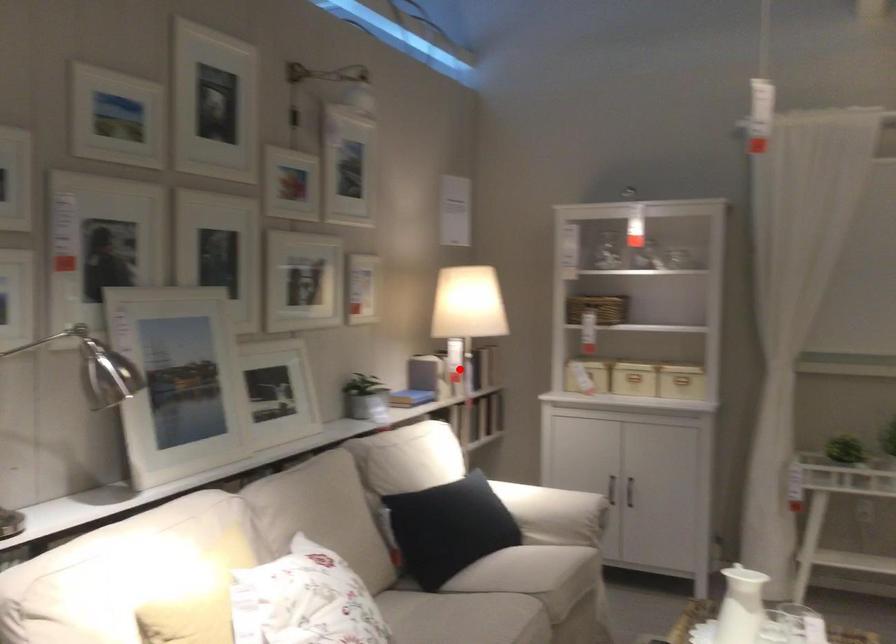
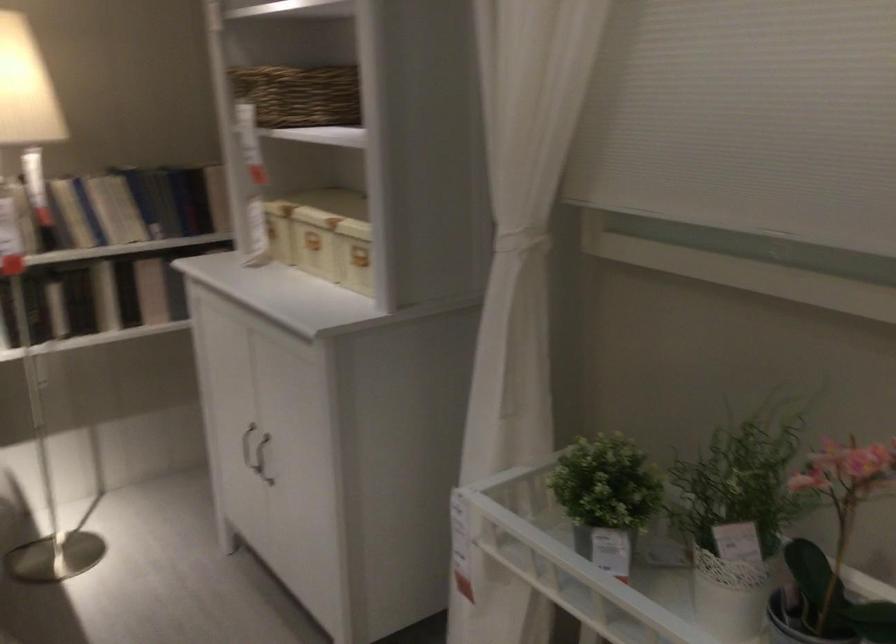
Question: I am providing you with two images of the same scene from different viewpoints. Image1 has a red point marked. In image2, the corresponding 3D location appears at what relative position? Reply with the corresponding letter.

Choices:
 (A) Closer
 (B) Farther

Answer: (A)